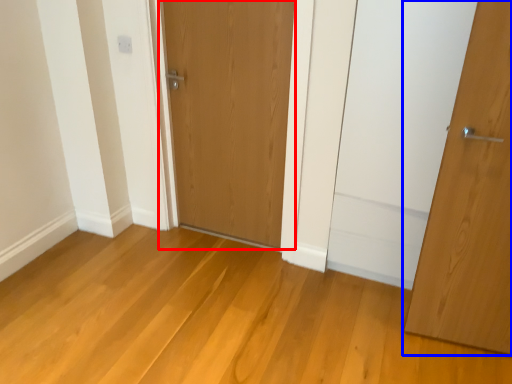
Question: Which point is closer to the camera, door (highlighted by a red box) or door (highlighted by a blue box)?

Choices:
 (A) door
 (B) door

Answer: (B)